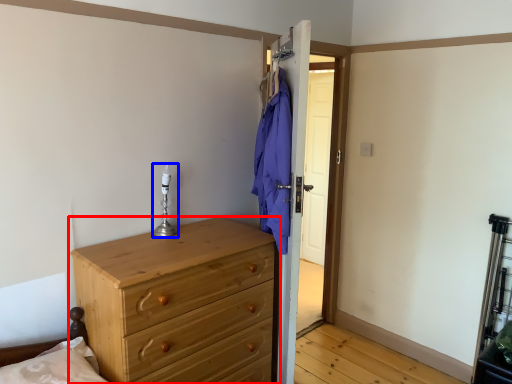
Question: Which object is further to the camera taking this photo, chest of drawers (highlighted by a red box) or candle holder (highlighted by a blue box)?

Choices:
 (A) chest of drawers
 (B) candle holder

Answer: (B)